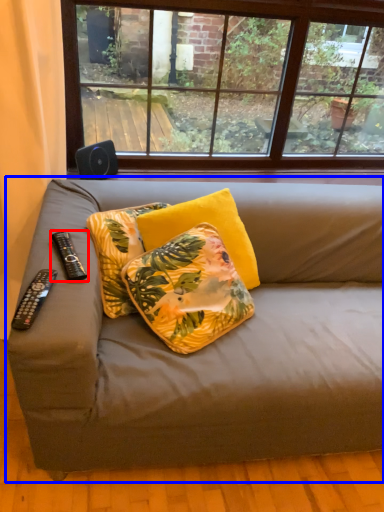
Question: Among these objects, which one is farthest to the camera, remote control (highlighted by a red box) or studio couch (highlighted by a blue box)?

Choices:
 (A) remote control
 (B) studio couch

Answer: (A)